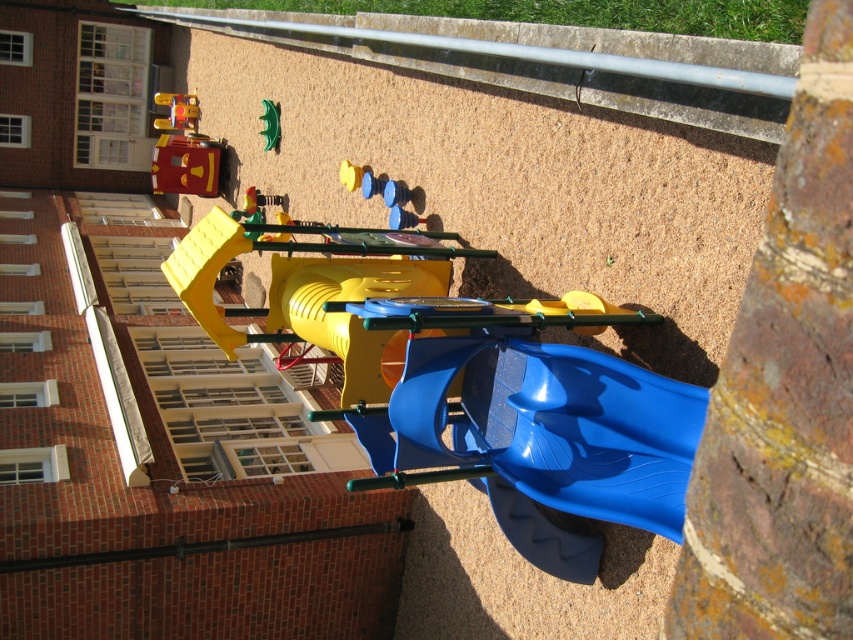
Who is taller, metallic red toy truck at upper left or green rubber toy at center?

metallic red toy truck at upper left

Measure the distance between metallic red toy truck at upper left and green rubber toy at center.

metallic red toy truck at upper left and green rubber toy at center are 4.92 meters apart from each other.

Which is behind, point (198, 186) or point (271, 112)?

The point (198, 186) is more distant.

Where is `metallic red toy truck at upper left`? This screenshot has height=640, width=853. metallic red toy truck at upper left is located at coordinates (183, 148).

Does metallic red toy truck at upper left have a smaller size compared to metallic yellow fire truck at upper left?

Incorrect, metallic red toy truck at upper left is not smaller in size than metallic yellow fire truck at upper left.

Is metallic red toy truck at upper left wider than metallic yellow fire truck at upper left?

Indeed, metallic red toy truck at upper left has a greater width compared to metallic yellow fire truck at upper left.

Is point (158, 140) more distant than point (157, 100)?

No, (158, 140) is closer to viewer.

Locate an element on the screen. This screenshot has height=640, width=853. metallic red toy truck at upper left is located at coordinates (183, 148).

Does metallic yellow fire truck at upper left have a greater height compared to green rubber toy at center?

Indeed, metallic yellow fire truck at upper left has a greater height compared to green rubber toy at center.

Identify the location of metallic yellow fire truck at upper left. (177, 112).